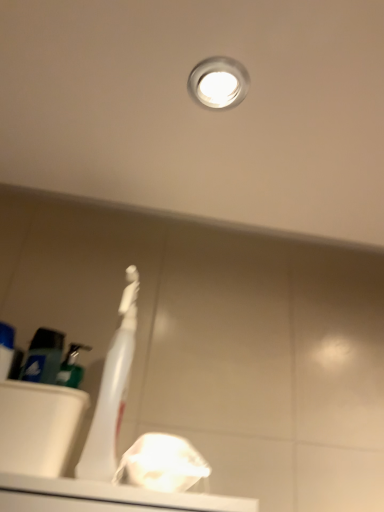
Question: Could you tell me if white glossy droplight at upper center is turned towards white plastic sink at lower left?

Choices:
 (A) no
 (B) yes

Answer: (A)

Question: Does white glossy droplight at upper center have a larger size compared to white plastic sink at lower left?

Choices:
 (A) yes
 (B) no

Answer: (B)

Question: Can you confirm if white glossy droplight at upper center is wider than white plastic sink at lower left?

Choices:
 (A) no
 (B) yes

Answer: (B)

Question: Is white glossy droplight at upper center to the right of white plastic sink at lower left from the viewer's perspective?

Choices:
 (A) no
 (B) yes

Answer: (B)

Question: Would you say white glossy droplight at upper center is outside white plastic sink at lower left?

Choices:
 (A) yes
 (B) no

Answer: (A)

Question: Is white glossy droplight at upper center spatially inside blue matte toothpaste tube at left, or outside of it?

Choices:
 (A) inside
 (B) outside

Answer: (B)

Question: In terms of height, does white glossy droplight at upper center look taller or shorter compared to blue matte toothpaste tube at left?

Choices:
 (A) tall
 (B) short

Answer: (B)

Question: From the image's perspective, is white glossy droplight at upper center located above or below blue matte toothpaste tube at left?

Choices:
 (A) above
 (B) below

Answer: (A)

Question: Considering their positions, is white glossy droplight at upper center located in front of or behind blue matte toothpaste tube at left?

Choices:
 (A) behind
 (B) front

Answer: (B)

Question: Is white plastic toothbrush at center to the left or to the right of blue matte toothpaste tube at left in the image?

Choices:
 (A) left
 (B) right

Answer: (B)

Question: From the image's perspective, is white plastic toothbrush at center located above or below blue matte toothpaste tube at left?

Choices:
 (A) below
 (B) above

Answer: (B)

Question: Is point (119, 406) positioned closer to the camera than point (3, 337)?

Choices:
 (A) closer
 (B) farther

Answer: (B)

Question: Which is correct: white plastic toothbrush at center is inside blue matte toothpaste tube at left, or outside of it?

Choices:
 (A) outside
 (B) inside

Answer: (A)

Question: From the image's perspective, is white plastic toothbrush at center above or below white glossy droplight at upper center?

Choices:
 (A) below
 (B) above

Answer: (A)

Question: Is white plastic toothbrush at center taller or shorter than white glossy droplight at upper center?

Choices:
 (A) short
 (B) tall

Answer: (B)